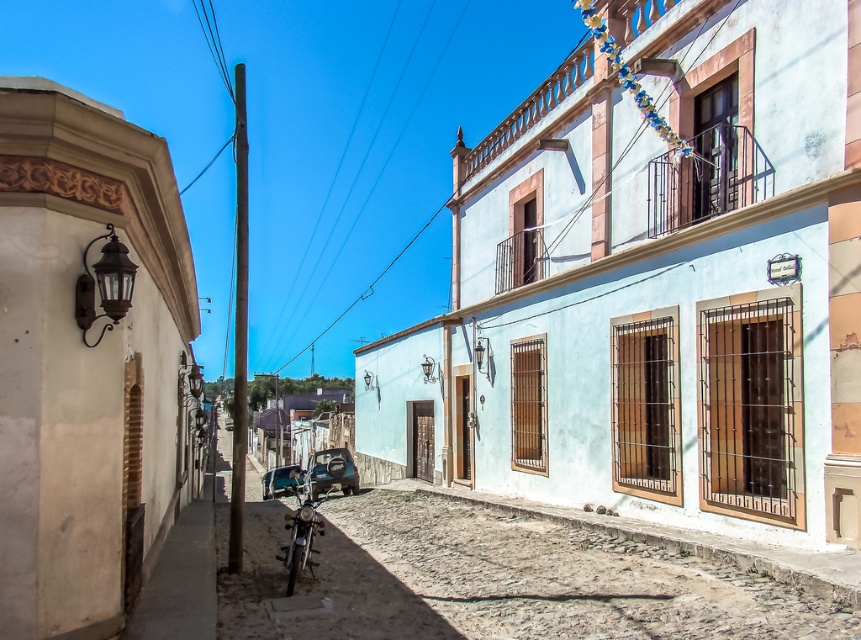
Question: Which point is farther to the camera?

Choices:
 (A) shiny chrome motorcycle at lower center
 (B) clear plastic power lines at upper center

Answer: (B)

Question: Based on their relative distances, which object is farther from the shiny chrome motorcycle at lower center?

Choices:
 (A) clear plastic power lines at upper center
 (B) brown wooden pole at center

Answer: (A)

Question: Which point is farther from the camera taking this photo?

Choices:
 (A) (300, 540)
 (B) (449, 198)
 (C) (331, 262)

Answer: (B)

Question: Can you confirm if shiny chrome motorcycle at lower center is wider than clear plastic power lines at upper center?

Choices:
 (A) yes
 (B) no

Answer: (B)

Question: Is shiny chrome motorcycle at lower center below clear plastic power lines at upper center?

Choices:
 (A) no
 (B) yes

Answer: (B)

Question: Considering the relative positions of shiny chrome motorcycle at lower center and brown wooden pole at center in the image provided, where is shiny chrome motorcycle at lower center located with respect to brown wooden pole at center?

Choices:
 (A) below
 (B) above

Answer: (A)